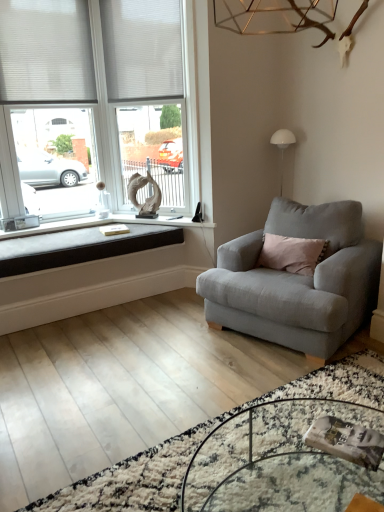
Question: In the image, is clear glass table at lower center positioned in front of or behind white fabric blind at upper left, the first blind when ordered from right to left?

Choices:
 (A) behind
 (B) front

Answer: (B)

Question: Do you think clear glass table at lower center is within white fabric blind at upper left, which is the 2th blind from left to right, or outside of it?

Choices:
 (A) outside
 (B) inside

Answer: (A)

Question: Which of these objects is positioned closest to the white fabric blind at upper left, placed as the 1th blind when sorted from left to right?

Choices:
 (A) white plastic window frame at upper left
 (B) white matte window at upper left
 (C) clear glass table at lower center
 (D) black fabric cushion at lower left
 (E) light gray fabric armchair at right

Answer: (B)

Question: Estimate the real-world distances between objects in this image. Which object is farther from the white matte window at upper left?

Choices:
 (A) clear glass table at lower center
 (B) white fabric blind at upper left, marked as the second blind in a right-to-left arrangement
 (C) light gray fabric armchair at right
 (D) white plastic window frame at upper left
 (E) black fabric cushion at lower left

Answer: (A)